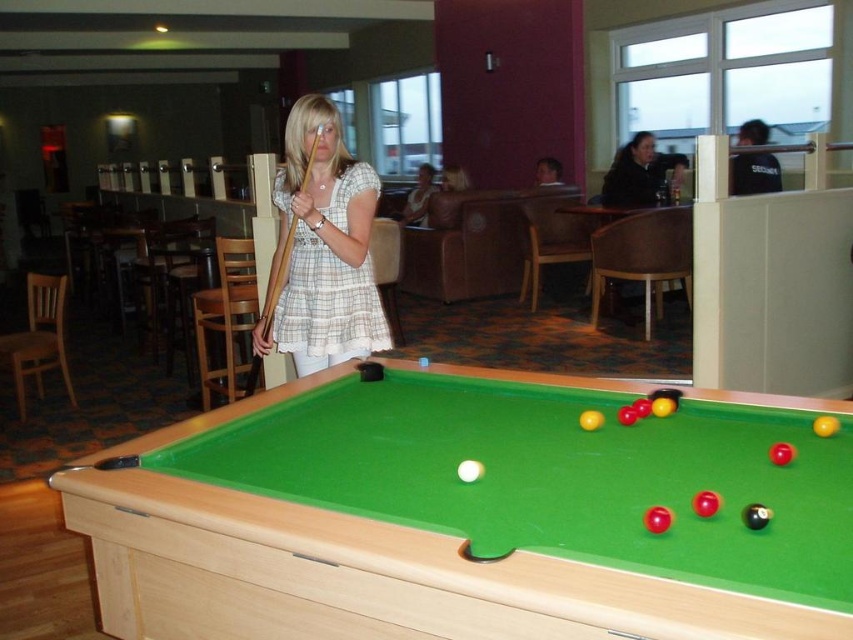
You are a person who is 1.7 meters tall. You are standing in the same position as the woman holding the pool cue. You want to reach the plaid fabric shirt at center. Can you touch it without moving your feet?

The plaid fabric shirt at center is 2.43 meters away from the viewer. Since the person is only 1.7 meters tall, they cannot reach it without moving their feet because the distance is greater than their height.

You are a photographer setting up for a photo shoot in this recreational area. You need to position a tall tripod that requires at least 2 meters of clearance. Based on the scene, which object between the wooden at left and the plaid fabric dress at center should you avoid placing the tripod near due to height restrictions?

The wooden at left is taller than the plaid fabric dress at center, so you should avoid placing the tripod near the wooden at left because it may not provide enough clearance for the tripod requiring 2 meters of height.